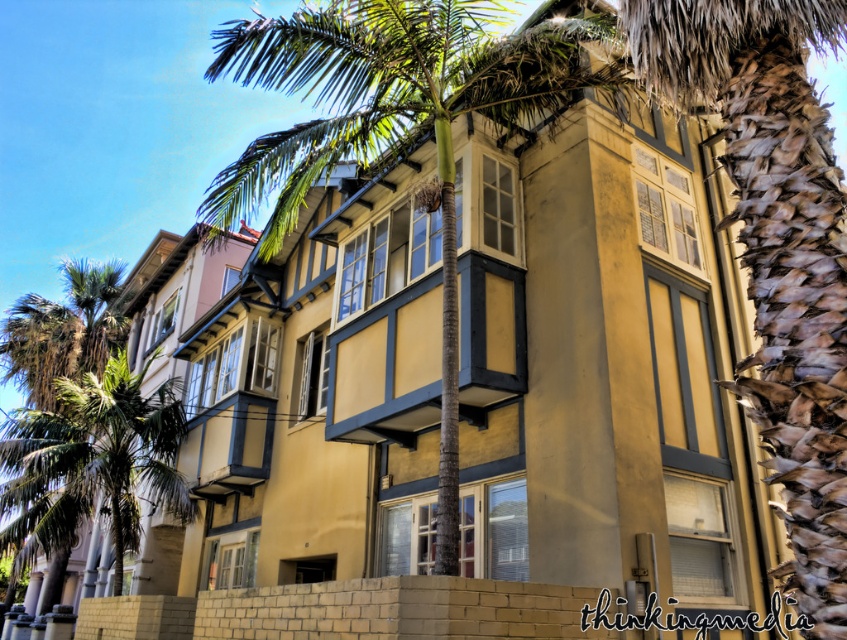
Which is above, green leafy palm tree at center or green leafy palm tree at left?

Positioned higher is green leafy palm tree at center.

Looking at this image, who is more distant from viewer, (288,184) or (62,486)?

The point (62,486) is more distant.

Image resolution: width=847 pixels, height=640 pixels. Find the location of `green leafy palm tree at center`. green leafy palm tree at center is located at coordinates (402, 125).

Does brown textured trunk at center-right have a lesser height compared to green leafy palm tree at center?

Correct, brown textured trunk at center-right is not as tall as green leafy palm tree at center.

Which of these two, brown textured trunk at center-right or green leafy palm tree at center, stands taller?

Standing taller between the two is green leafy palm tree at center.

Does point (807, 307) lie behind point (439, 179)?

No, it is not.

The image size is (847, 640). I want to click on brown textured trunk at center-right, so click(776, 250).

How distant is brown textured trunk at center-right from green leafy palm tree at left?

The distance of brown textured trunk at center-right from green leafy palm tree at left is 11.68 meters.

Can you confirm if brown textured trunk at center-right is bigger than green leafy palm tree at left?

Indeed, brown textured trunk at center-right has a larger size compared to green leafy palm tree at left.

Is point (800, 321) less distant than point (115, 536)?

Yes, point (800, 321) is closer to viewer.

Where is `brown textured trunk at center-right`? The image size is (847, 640). brown textured trunk at center-right is located at coordinates (776, 250).